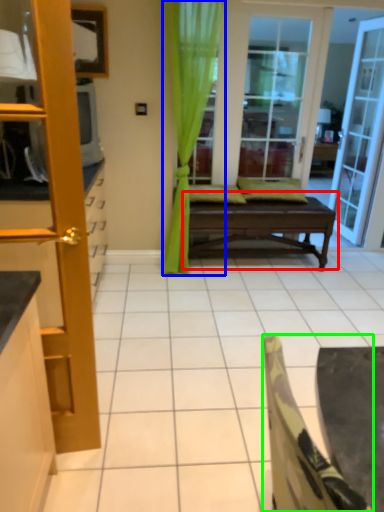
Question: Estimate the real-world distances between objects in this image. Which object is farther from table (highlighted by a red box), curtain (highlighted by a blue box) or chair (highlighted by a green box)?

Choices:
 (A) curtain
 (B) chair

Answer: (B)